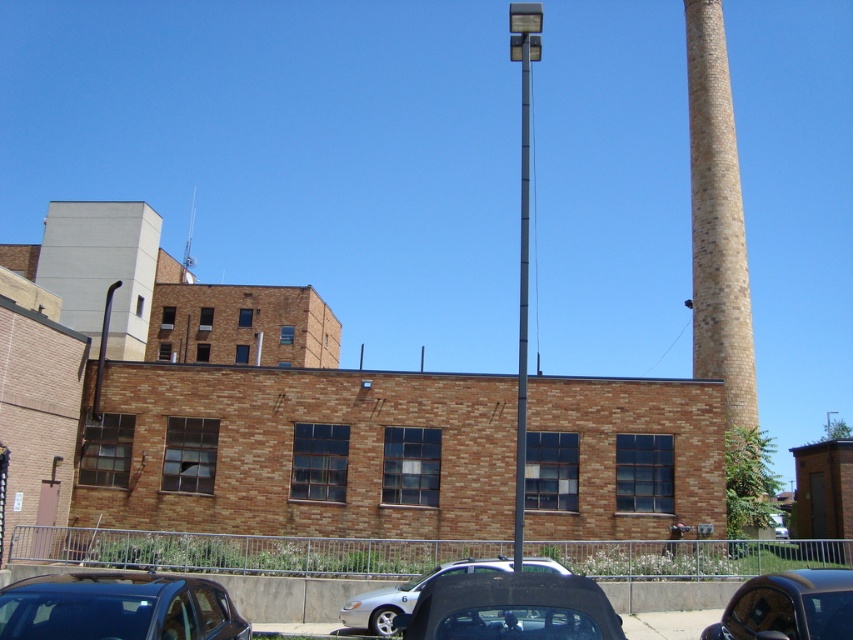
At what (x,y) coordinates should I click in order to perform the action: click on metallic gray pole at center. Please return your answer as a coordinate pair (x, y). Looking at the image, I should click on (521, 240).

Is point (526, 346) closer to viewer compared to point (544, 557)?

That is False.

In order to click on metallic gray pole at center in this screenshot , I will do `click(521, 240)`.

Does matte black car at lower center appear under metallic gray pole at center?

Correct, matte black car at lower center is located below metallic gray pole at center.

Who is more forward, (445, 605) or (526, 368)?

Point (445, 605) is in front.

The width and height of the screenshot is (853, 640). In order to click on matte black car at lower center in this screenshot , I will do `click(509, 609)`.

This screenshot has width=853, height=640. What do you see at coordinates (119, 608) in the screenshot? I see `shiny blue car at lower left` at bounding box center [119, 608].

Does shiny blue car at lower left have a lesser height compared to matte black sedan at lower center?

Incorrect, shiny blue car at lower left's height does not fall short of matte black sedan at lower center's.

Is point (90, 582) closer to camera compared to point (381, 614)?

That is True.

Where is `shiny blue car at lower left`? shiny blue car at lower left is located at coordinates (119, 608).